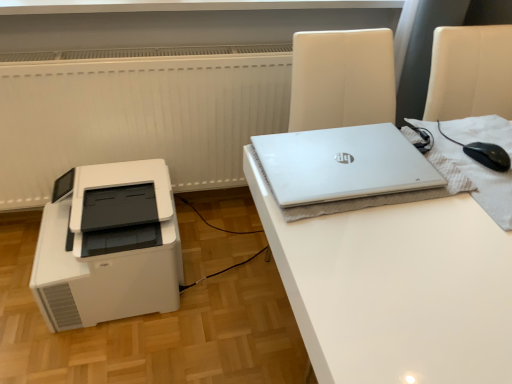
Locate an element on the screen. This screenshot has width=512, height=384. vacant area that lies to the right of white plastic printer at lower left is located at coordinates pos(218,288).